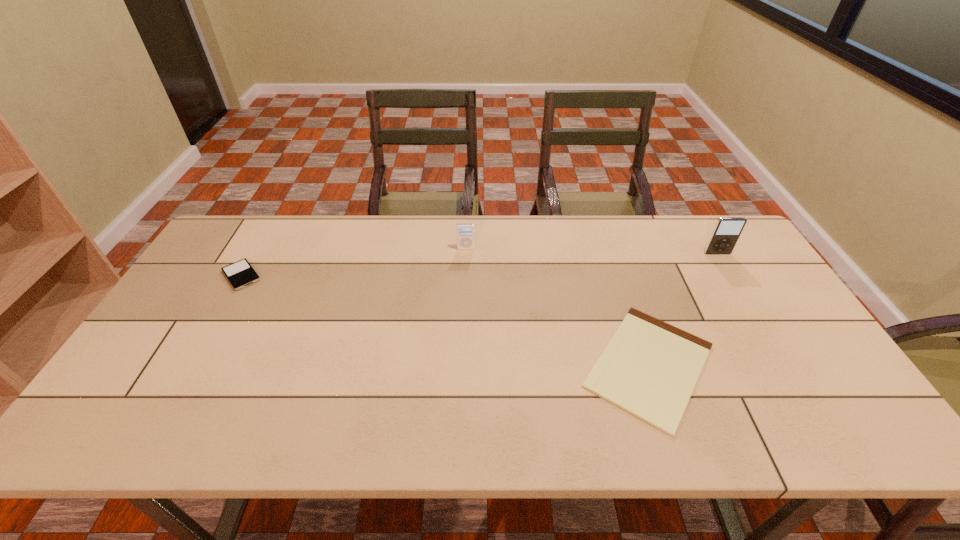
Find the location of `free space between the rightmost iPod and the second iPod from left to right`. free space between the rightmost iPod and the second iPod from left to right is located at coordinates (591, 251).

Find the location of a particular element. empty space that is in between the farthest iPod and the second nearest object is located at coordinates (353, 262).

Identify the location of the third closest object to the tallest object. The width and height of the screenshot is (960, 540). (240, 274).

Image resolution: width=960 pixels, height=540 pixels. I want to click on object that is the third closest to the nearest iPod, so click(725, 235).

I want to click on iPod that is the closest to the second object from right to left, so click(x=725, y=235).

Identify which iPod is located as the second nearest to the third tallest object. Please provide its 2D coordinates. Your answer should be formatted as a tuple, i.e. [(x, y)], where the tuple contains the x and y coordinates of a point satisfying the conditions above.

[(725, 235)]

Image resolution: width=960 pixels, height=540 pixels. In order to click on free point that satisfies the following two spatial constraints: 1. on the front-facing side of the farthest object; 2. on the left side of the clipboard in this screenshot , I will do `click(462, 366)`.